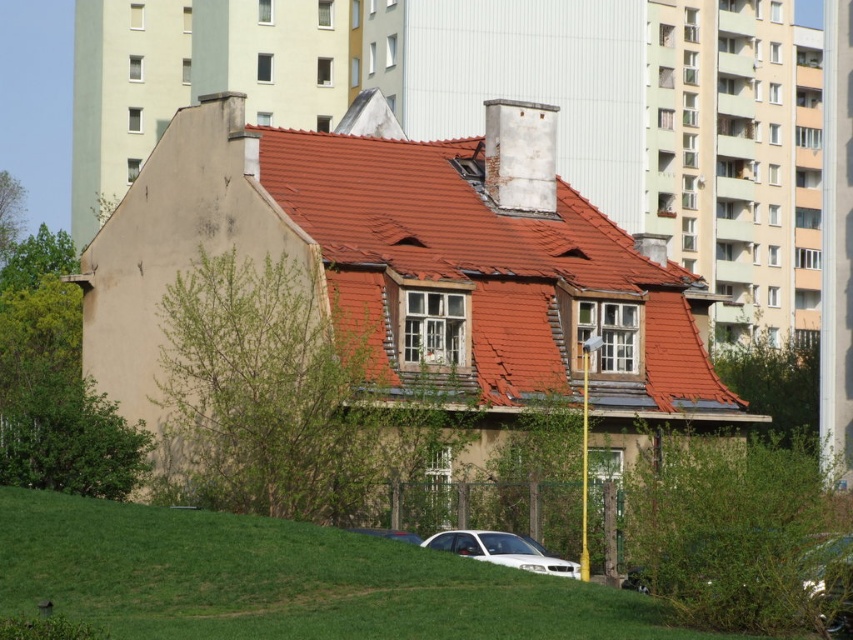
You are a delivery person trying to park your white glossy car at lower center in front of the house. The red tile roof at center is in the way. Can you park there without the car overlapping the roof?

The red tile roof at center is bigger than the white glossy car at lower center, but since the roof is on top of the house and the car is parked in front, they won

You are a gardener who needs to mow the lawn. You see the green grass at lower center and the metallic silver car at lower center. Which object is taller and requires attention first?

The green grass at lower center is taller than the metallic silver car at lower center, so you should mow the green grass at lower center first.